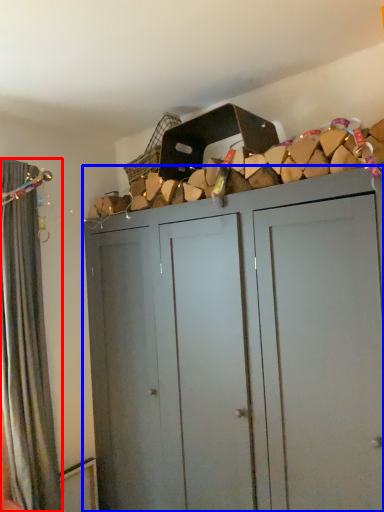
Question: Among these objects, which one is nearest to the camera, curtain (highlighted by a red box) or cupboard (highlighted by a blue box)?

Choices:
 (A) curtain
 (B) cupboard

Answer: (B)